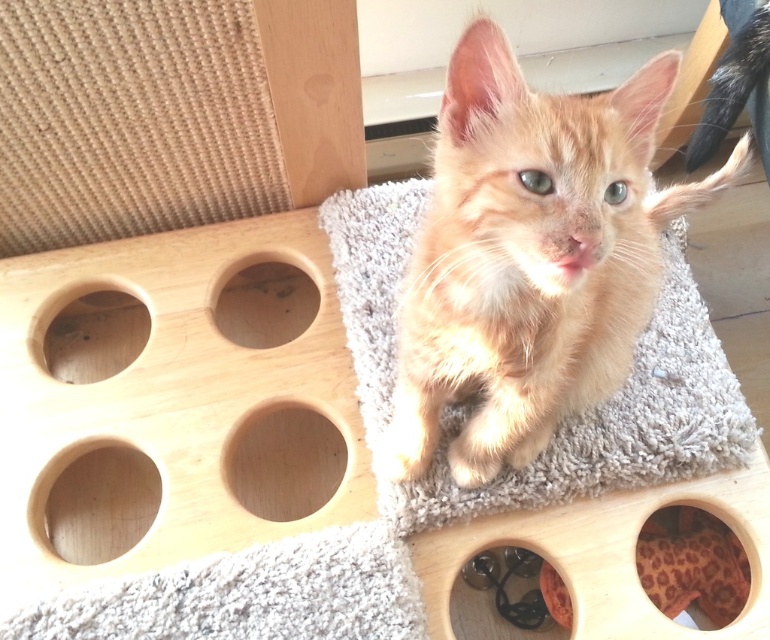
You are a small toy mouse. You want to move from the leopard print fabric at lower right to the smooth light brown wooden hole at lower left. Can you fit through the space between them?

The smooth light brown wooden hole at lower left has a larger size compared to leopard print fabric at lower right. Since the wooden hole is larger, the toy mouse can likely fit through the space between them.

You are a cat owner trying to decide where to place a new cat tree. You see the smooth light brown wooden hole at lower left and the leopard print fabric at lower right. Which of these two items is taller?

The smooth light brown wooden hole at lower left is taller than the leopard print fabric at lower right according to the description.

You are a cat owner who wants to place a 10 inch toy between the leopard print fabric at lower right and the black rubber hole at lower center. Can you fit the toy between them?

The distance between the leopard print fabric at lower right and the black rubber hole at lower center is 9.91 inches, so the 10 inch toy cannot fit between them as it is slightly longer than the available space.